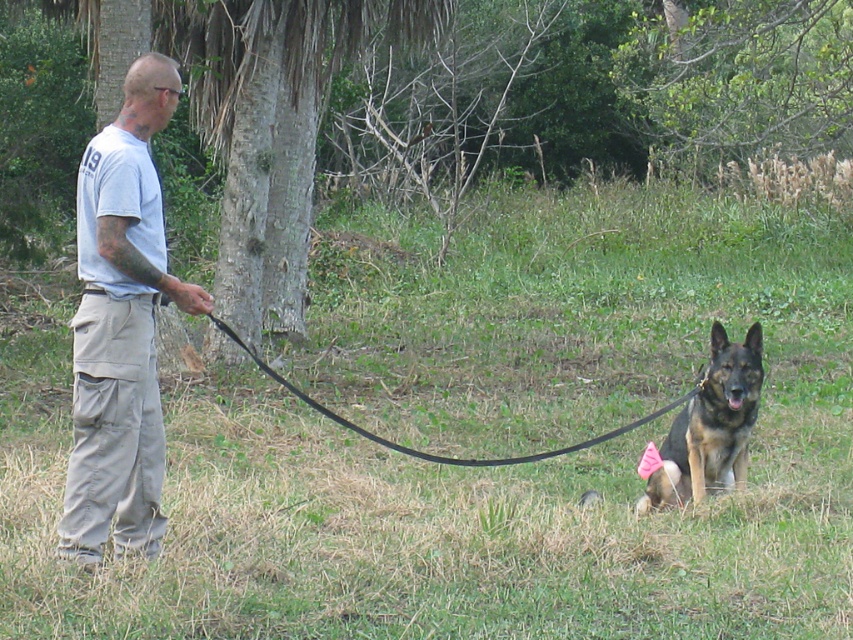
Question: Estimate the real-world distances between objects in this image. Which object is farther from the brown fur dog at lower right?

Choices:
 (A) green leafy tree at upper center
 (B) black rubber leash at center
 (C) light gray cotton t-shirt at center

Answer: (A)

Question: Is green leafy tree at upper center thinner than black rubber leash at center?

Choices:
 (A) no
 (B) yes

Answer: (A)

Question: Is green leafy tree at upper center positioned at the back of black rubber leash at center?

Choices:
 (A) yes
 (B) no

Answer: (A)

Question: Can you confirm if brown fur dog at lower right is smaller than black rubber leash at center?

Choices:
 (A) yes
 (B) no

Answer: (A)

Question: Which point is closer to the camera?

Choices:
 (A) (775, 88)
 (B) (633, 422)
 (C) (650, 605)

Answer: (C)

Question: Estimate the real-world distances between objects in this image. Which object is farther from the brown fur dog at lower right?

Choices:
 (A) green leafy tree at upper center
 (B) green grass at center

Answer: (A)